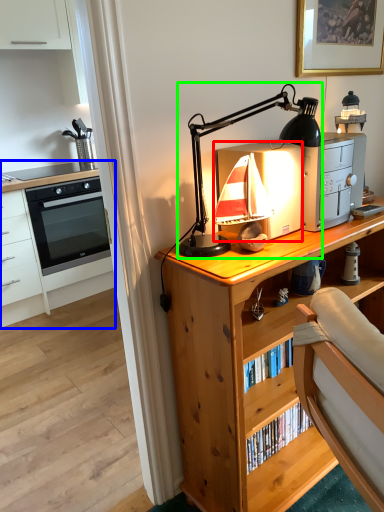
Question: Which object is the closest to the appliance (highlighted by a red box)? Choose among these: chest of drawers (highlighted by a blue box) or lamp (highlighted by a green box).

Choices:
 (A) chest of drawers
 (B) lamp

Answer: (B)